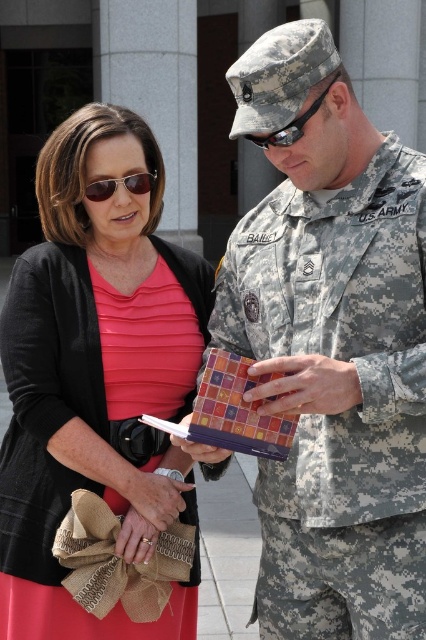
What is located at the coordinate point (331, 346) in the image?

The camouflage uniform at center is located at point (331, 346).

You are a photographer trying to capture a clear shot of both the camouflage uniform at center and the matte black sunglasses at upper left. Since you want to ensure both are in focus, which object should you adjust your camera focus on first, considering their sizes?

The camouflage uniform at center is larger in size compared to the matte black sunglasses at upper left. To ensure both are in focus, you should focus on the larger object first, which is the camouflage uniform at center, as it has more details to capture.